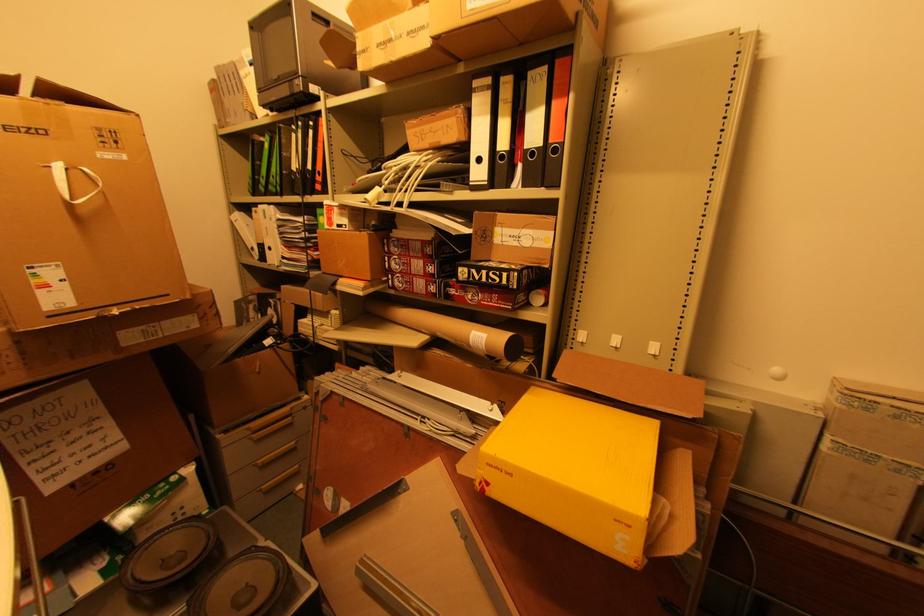
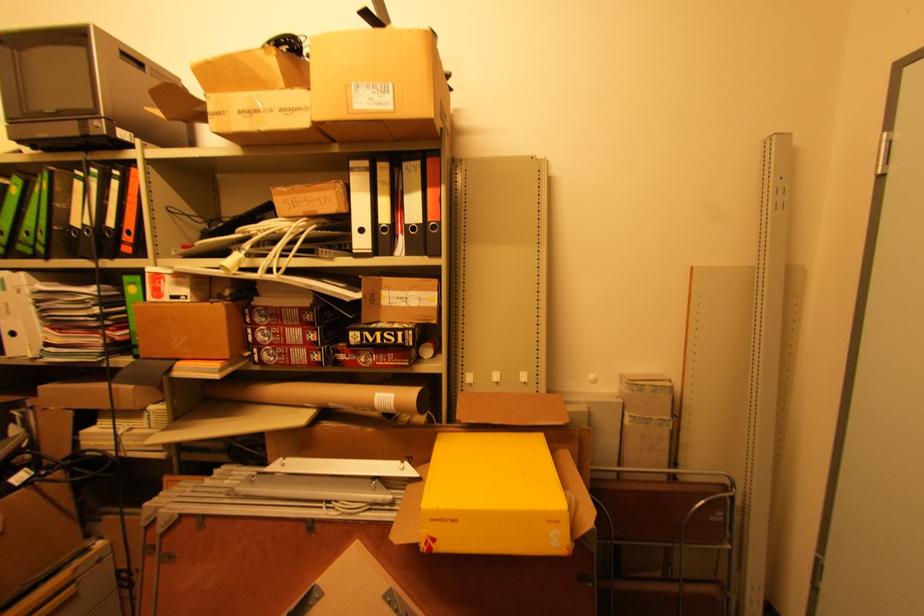
Locate, in the second image, the point that corresponds to [322,179] in the first image.

(131, 238)